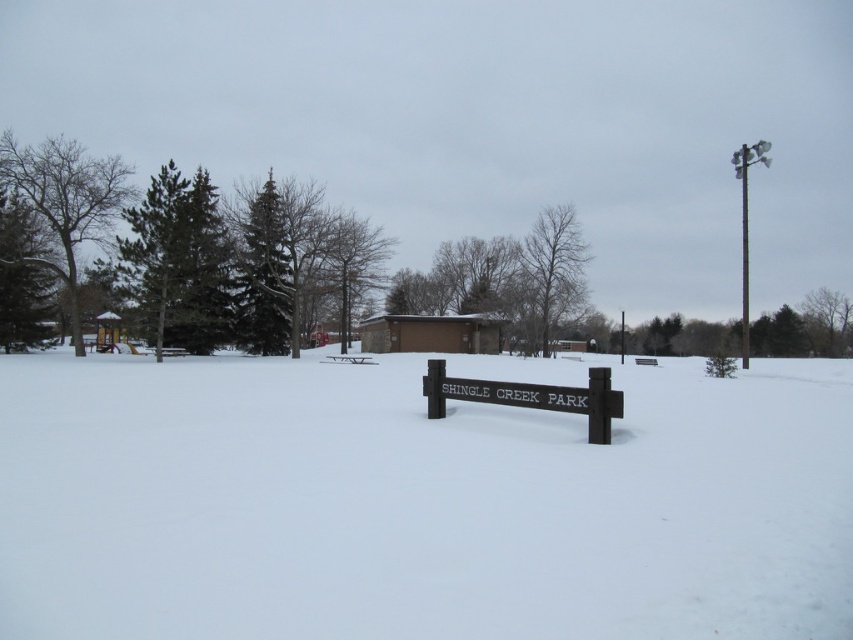
Can you confirm if bare wood tree at center is thinner than metallic pole at upper right?

Correct, bare wood tree at center's width is less than metallic pole at upper right's.

Does point (587, 252) lie behind point (744, 218)?

That is False.

Locate an element on the screen. The width and height of the screenshot is (853, 640). bare wood tree at center is located at coordinates (550, 272).

Between white powdery snow at center and green needle-like tree at left, which one appears on the left side from the viewer's perspective?

green needle-like tree at left is more to the left.

Locate an element on the screen. The height and width of the screenshot is (640, 853). white powdery snow at center is located at coordinates (419, 500).

Is point (457, 550) positioned in front of point (112, 208)?

Yes, point (457, 550) is in front of point (112, 208).

This screenshot has width=853, height=640. In order to click on white powdery snow at center in this screenshot , I will do `click(419, 500)`.

The width and height of the screenshot is (853, 640). What do you see at coordinates (419, 500) in the screenshot?
I see `white powdery snow at center` at bounding box center [419, 500].

Where is `white powdery snow at center`? The height and width of the screenshot is (640, 853). white powdery snow at center is located at coordinates (419, 500).